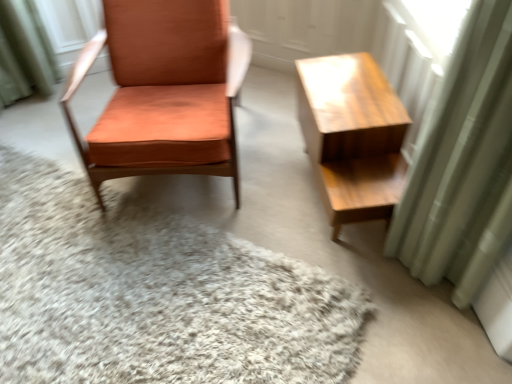
Question: Would you say light brown wood table at right is a long distance from orange leather chair at left?

Choices:
 (A) yes
 (B) no

Answer: (B)

Question: Can you confirm if light brown wood table at right is bigger than orange leather chair at left?

Choices:
 (A) yes
 (B) no

Answer: (B)

Question: From a real-world perspective, is light brown wood table at right physically above orange leather chair at left?

Choices:
 (A) yes
 (B) no

Answer: (B)

Question: Is light brown wood table at right thinner than orange leather chair at left?

Choices:
 (A) no
 (B) yes

Answer: (B)

Question: From the image's perspective, is light brown wood table at right beneath orange leather chair at left?

Choices:
 (A) yes
 (B) no

Answer: (A)

Question: From a real-world perspective, is light brown wood table at right under orange leather chair at left?

Choices:
 (A) no
 (B) yes

Answer: (B)

Question: Considering the relative sizes of white shaggy rug at center and orange leather chair at left in the image provided, is white shaggy rug at center wider than orange leather chair at left?

Choices:
 (A) no
 (B) yes

Answer: (B)

Question: Is white shaggy rug at center positioned before orange leather chair at left?

Choices:
 (A) yes
 (B) no

Answer: (A)

Question: Can you confirm if white shaggy rug at center is taller than orange leather chair at left?

Choices:
 (A) yes
 (B) no

Answer: (B)

Question: Is white shaggy rug at center smaller than orange leather chair at left?

Choices:
 (A) yes
 (B) no

Answer: (A)

Question: Considering the relative positions of white shaggy rug at center and orange leather chair at left in the image provided, is white shaggy rug at center to the left of orange leather chair at left from the viewer's perspective?

Choices:
 (A) no
 (B) yes

Answer: (B)

Question: Does white shaggy rug at center contain orange leather chair at left?

Choices:
 (A) no
 (B) yes

Answer: (A)

Question: Does green fabric curtain at right have a lesser width compared to white shaggy rug at center?

Choices:
 (A) yes
 (B) no

Answer: (A)